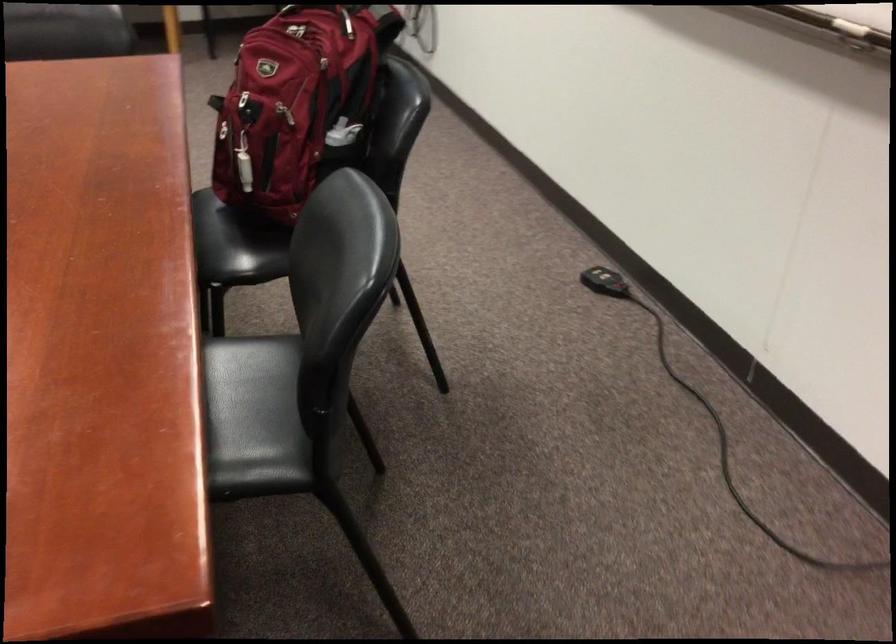
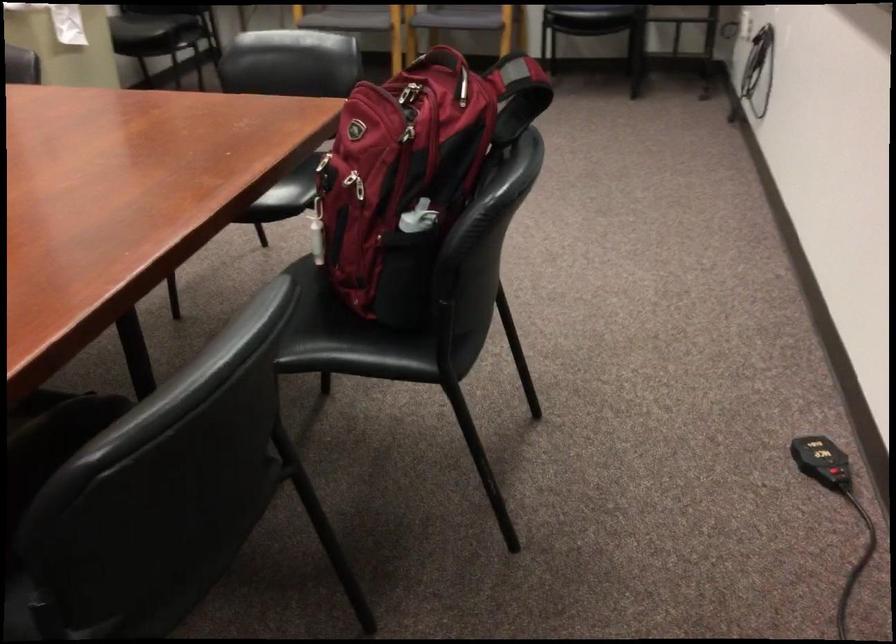
Locate, in the second image, the point that corresponds to pixel 602 283 in the first image.

(822, 460)